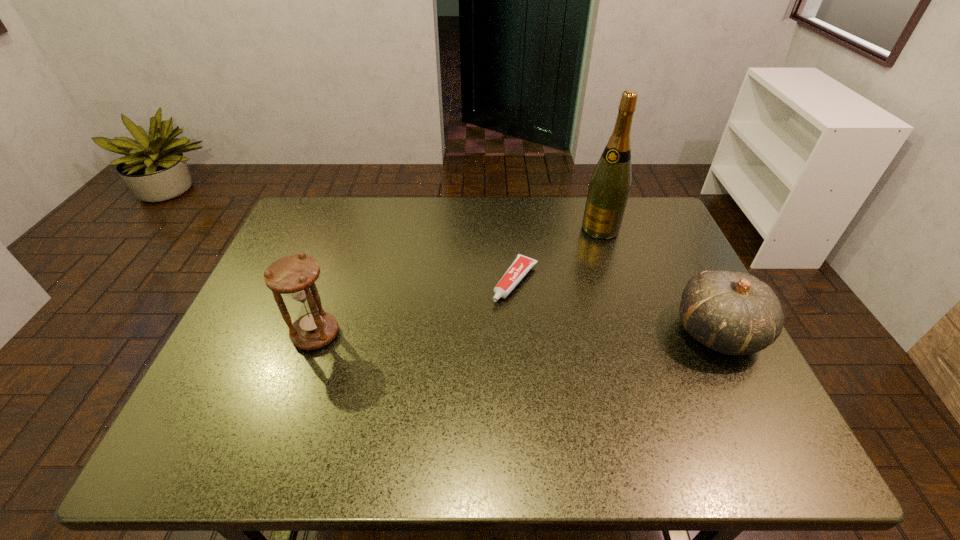
At what (x,y) coordinates should I click in order to perform the action: click on vacant space that satisfies the following two spatial constraints: 1. on the back side of the hourglass; 2. on the left side of the rightmost object. Please return your answer as a coordinate pair (x, y). Image resolution: width=960 pixels, height=540 pixels. Looking at the image, I should click on (317, 331).

Find the location of a particular element. This screenshot has height=540, width=960. free space that satisfies the following two spatial constraints: 1. on the back side of the hourglass; 2. on the left side of the shortest object is located at coordinates (334, 281).

Image resolution: width=960 pixels, height=540 pixels. In order to click on free spot that satisfies the following two spatial constraints: 1. on the front side of the gourd; 2. on the left side of the second object from right to left in this screenshot , I will do `click(635, 331)`.